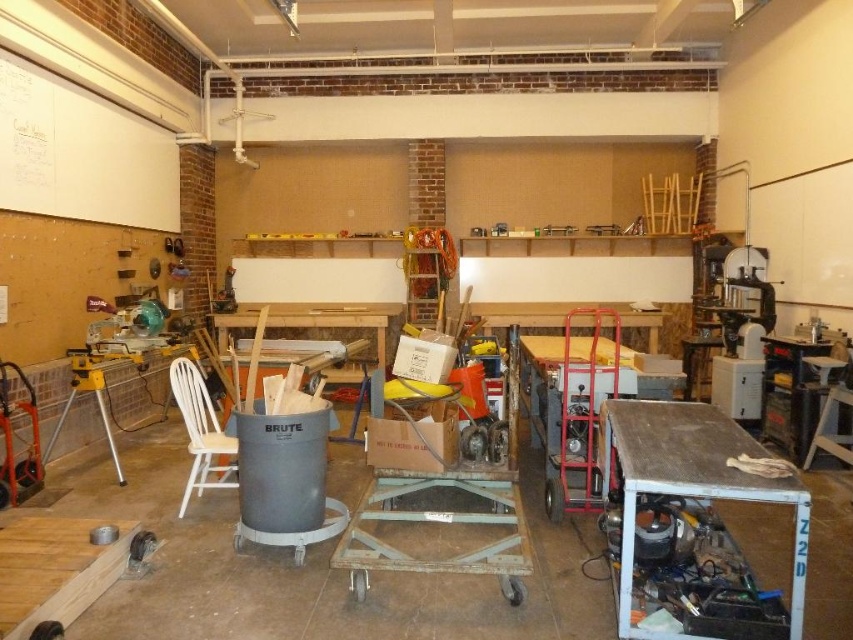
Which is behind, point (91, 216) or point (793, 586)?

The point (91, 216) is more distant.

Is point (99, 173) less distant than point (677, 472)?

No.

This screenshot has height=640, width=853. I want to click on white matte bulletin board at upper left, so click(80, 154).

Who is lower down, wooden workbench at lower right or white wood chair at left?

white wood chair at left is lower down.

Does point (700, 417) lie in front of point (225, 477)?

Yes, it is in front of point (225, 477).

I want to click on wooden workbench at lower right, so click(692, 483).

Between white matte bulletin board at upper left and white wood chair at left, which one has less height?

white wood chair at left is shorter.

Can you confirm if white matte bulletin board at upper left is taller than white wood chair at left?

Yes.

Between point (1, 204) and point (195, 476), which one is positioned behind?

The point (1, 204) is behind.

The width and height of the screenshot is (853, 640). In order to click on white matte bulletin board at upper left in this screenshot , I will do `click(80, 154)`.